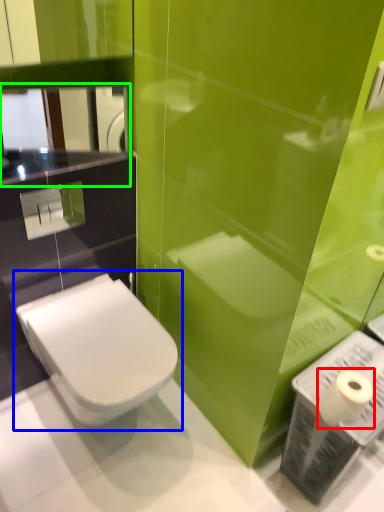
Question: Considering the real-world distances, which object is closest to toilet paper (highlighted by a red box)? toilet (highlighted by a blue box) or mirror (highlighted by a green box).

Choices:
 (A) toilet
 (B) mirror

Answer: (A)